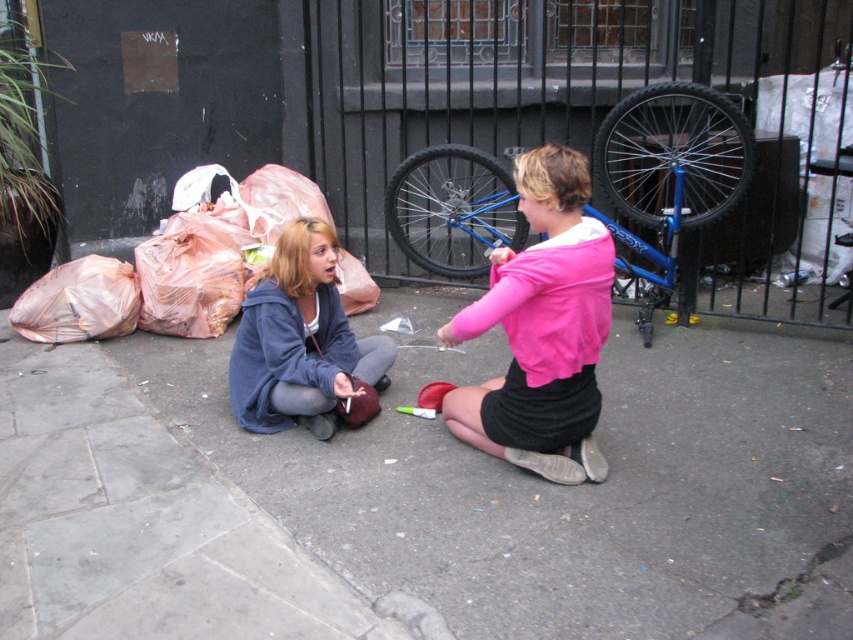
You are a delivery person needing to place a small package between the concrete pavement at center and the pink matte shirt at center. Can you fit the package in the space between them if the package requires at least 60 centimeters of space?

The distance between the concrete pavement at center and the pink matte shirt at center is 71.09 centimeters, which is more than the required 60 centimeters. Therefore, the package can be placed there.

You are a delivery person who needs to place a package on the concrete pavement at center. What are the coordinates where you should place the package?

The concrete pavement at center is located at coordinates point (564, 486), so place the package there.

You are a delivery person who needs to pick up a package from the ground. You see the plastic bags at lower left and the matte blue hoodie at center. Which object is closer to you?

The plastic bags at lower left are closer to you because the matte blue hoodie at center is behind them.